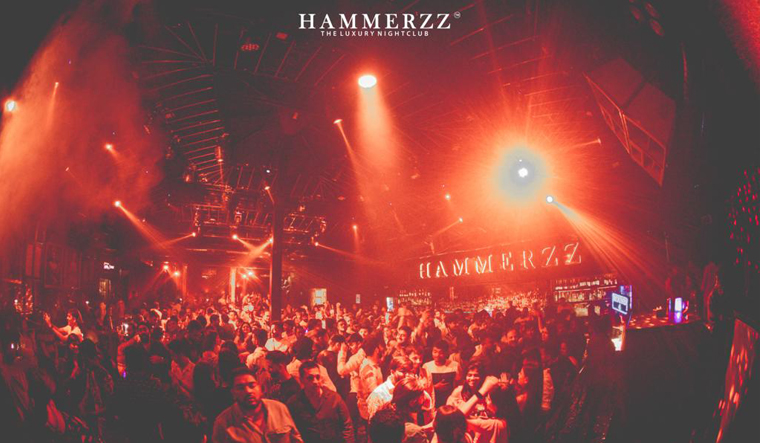
Locate an element on the screen. This screenshot has width=760, height=443. speakers is located at coordinates (670, 117), (621, 84).